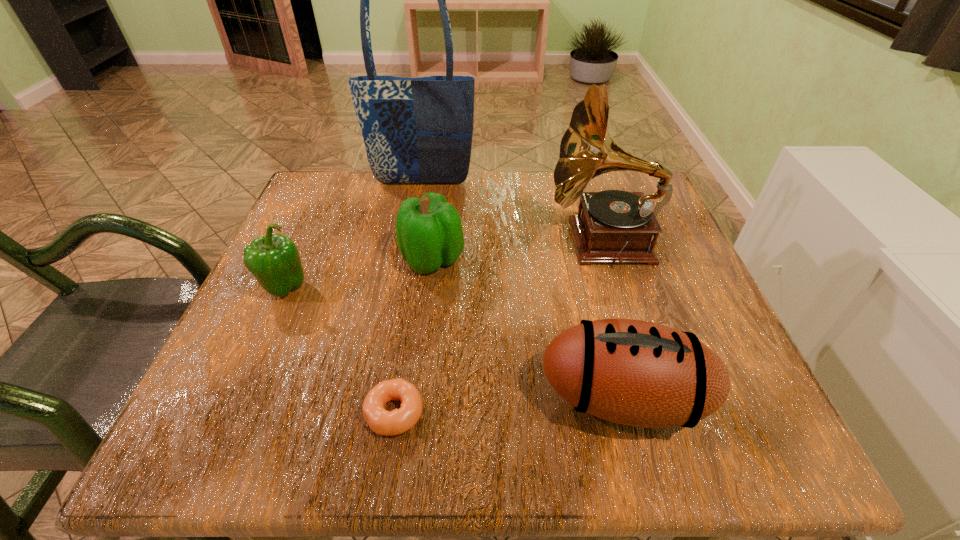
Identify the location of the tallest object. This screenshot has width=960, height=540. (419, 130).

Find the location of a particular element. The image size is (960, 540). the farthest object is located at coordinates (419, 130).

You are a GUI agent. You are given a task and a screenshot of the screen. Output one action in this format:
    pyautogui.click(x=<x>, y=<y>)
    Task: Click on the phonograph_record
    This screenshot has height=540, width=960.
    Given the screenshot: What is the action you would take?
    pyautogui.click(x=616, y=226)

Identify the location of the right bell pepper. The width and height of the screenshot is (960, 540). (429, 233).

You are a GUI agent. You are given a task and a screenshot of the screen. Output one action in this format:
    pyautogui.click(x=<x>, y=<y>)
    Task: Click on the left bell pepper
    
    Given the screenshot: What is the action you would take?
    pyautogui.click(x=274, y=260)

Image resolution: width=960 pixels, height=540 pixels. I want to click on football (American), so click(x=637, y=373).

At what (x,y) coordinates should I click in order to perform the action: click on doughnut. Please return your answer as a coordinate pair (x, y). Looking at the image, I should click on (382, 422).

What are the coordinates of `free space located 0.340m on the front-facing side of the tallest object` in the screenshot? It's located at (403, 289).

Locate an element on the screen. vacant region located on the horn of the phonograph_record is located at coordinates (396, 241).

Find the location of a particular element. vacant space located 0.260m on the horn of the phonograph_record is located at coordinates (425, 241).